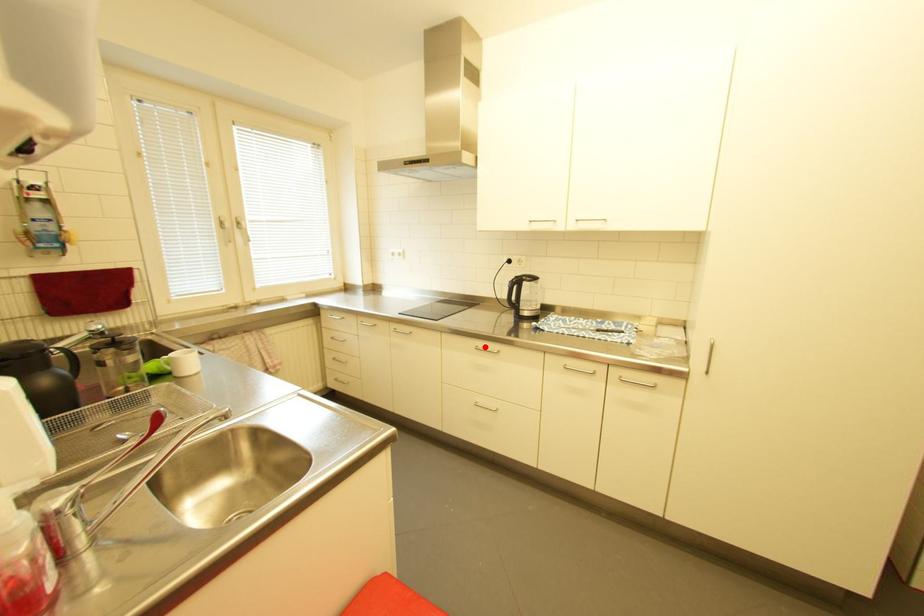
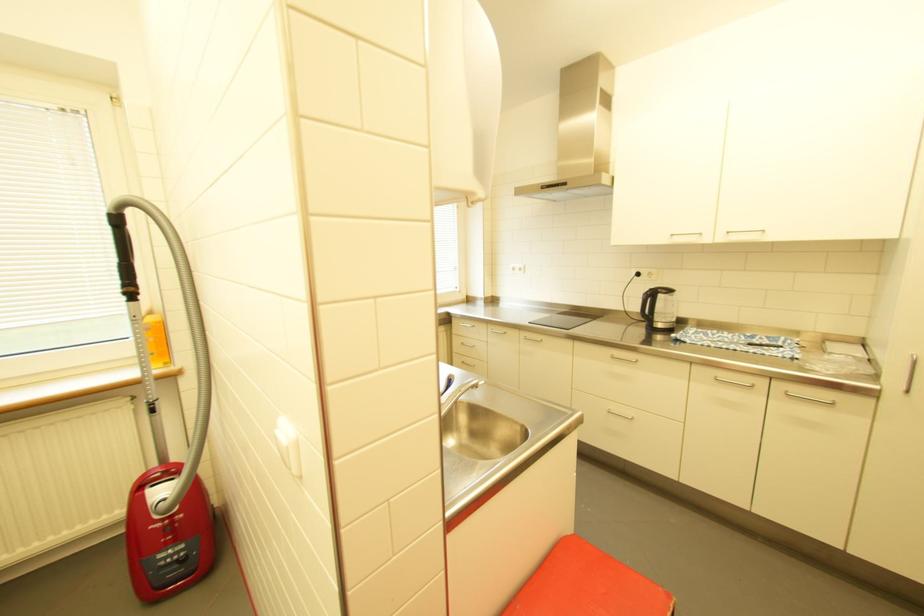
In the second image, find the point that corresponds to the highlighted location in the first image.

(621, 355)